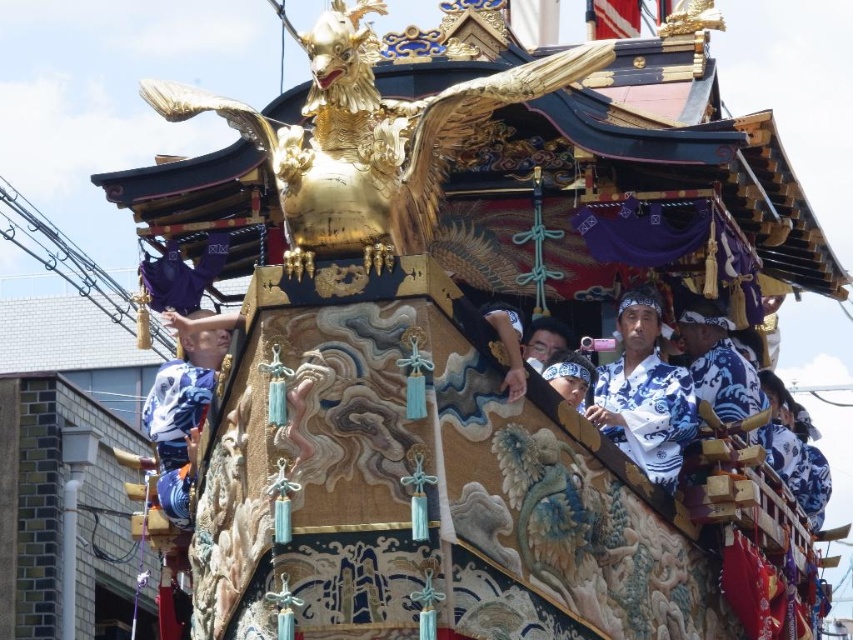
You are a photographer at the front of the float and see two participants wearing a white cotton kimono at center and a blue and white kimono at center. Which kimono is positioned to the right when viewed from the front?

The white cotton kimono at center is positioned to the right of the blue and white kimono at center when viewed from the front.

In the scene shown: You are a photographer at the festival and want to capture both the white cotton kimono at center and the blue and white kimono at center in a single frame. Which kimono will appear shorter in the photo?

The white cotton kimono at center will appear shorter in the photo because it has a lesser height compared to the blue and white kimono at center.